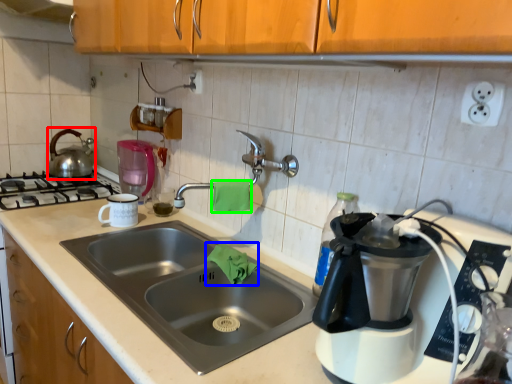
Question: Estimate the real-world distances between objects in this image. Which object is closer to tea pot (highlighted by a red box), material (highlighted by a blue box) or material (highlighted by a green box)?

Choices:
 (A) material
 (B) material

Answer: (A)